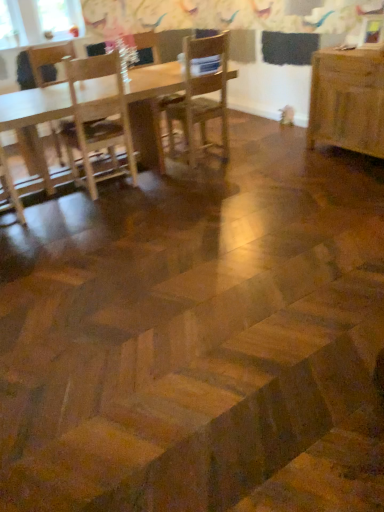
Question: Does wooden table at right, acting as the 2th table starting from the left, turn towards wooden chair at center, positioned as the 2th chair in left-to-right order?

Choices:
 (A) yes
 (B) no

Answer: (B)

Question: From a real-world perspective, does wooden table at right, which is the 1th table in right-to-left order, stand above wooden chair at center, which ranks as the second chair in right-to-left order?

Choices:
 (A) no
 (B) yes

Answer: (A)

Question: Can wooden chair at center, positioned as the 2th chair in left-to-right order, be found inside wooden table at right, which is the 1th table in right-to-left order?

Choices:
 (A) no
 (B) yes

Answer: (A)

Question: Is wooden table at right, which is the 1th table in right-to-left order, next to wooden chair at center, which ranks as the second chair in right-to-left order?

Choices:
 (A) yes
 (B) no

Answer: (B)

Question: Does wooden table at right, acting as the 2th table starting from the left, come behind wooden chair at center, which ranks as the second chair in right-to-left order?

Choices:
 (A) yes
 (B) no

Answer: (B)

Question: From the image's perspective, is wooden table at right, which is the 1th table in right-to-left order, located above or below wooden chair at center, acting as the first chair starting from the right?

Choices:
 (A) below
 (B) above

Answer: (A)

Question: Which is correct: wooden table at right, acting as the 2th table starting from the left, is inside wooden chair at center, acting as the first chair starting from the right, or outside of it?

Choices:
 (A) outside
 (B) inside

Answer: (A)

Question: Based on their positions, is wooden table at right, which is the 1th table in right-to-left order, located to the left or right of wooden chair at center, which is counted as the third chair, starting from the left?

Choices:
 (A) left
 (B) right

Answer: (B)

Question: From a real-world perspective, is wooden table at right, acting as the 2th table starting from the left, positioned above or below wooden chair at center, which is counted as the third chair, starting from the left?

Choices:
 (A) below
 (B) above

Answer: (A)

Question: From their relative heights in the image, would you say wooden chair at center, positioned as the 2th chair in left-to-right order, is taller or shorter than light brown wooden chair at left, which is the third chair in right-to-left order?

Choices:
 (A) tall
 (B) short

Answer: (B)

Question: Visually, is wooden chair at center, positioned as the 2th chair in left-to-right order, positioned to the left or to the right of light brown wooden chair at left, arranged as the 1th chair when viewed from the left?

Choices:
 (A) left
 (B) right

Answer: (B)

Question: Considering the positions of wooden chair at center, positioned as the 2th chair in left-to-right order, and light brown wooden chair at left, arranged as the 1th chair when viewed from the left, in the image, is wooden chair at center, positioned as the 2th chair in left-to-right order, wider or thinner than light brown wooden chair at left, arranged as the 1th chair when viewed from the left,?

Choices:
 (A) wide
 (B) thin

Answer: (A)

Question: From a real-world perspective, relative to light brown wooden chair at left, arranged as the 1th chair when viewed from the left, is wooden chair at center, which ranks as the second chair in right-to-left order, vertically above or below?

Choices:
 (A) above
 (B) below

Answer: (B)

Question: Is point (3, 95) positioned closer to the camera than point (155, 100)?

Choices:
 (A) closer
 (B) farther

Answer: (A)

Question: From a real-world perspective, is wooden table at upper left, the 1th table in the left-to-right sequence, positioned above or below wooden chair at center, which ranks as the second chair in right-to-left order?

Choices:
 (A) above
 (B) below

Answer: (B)